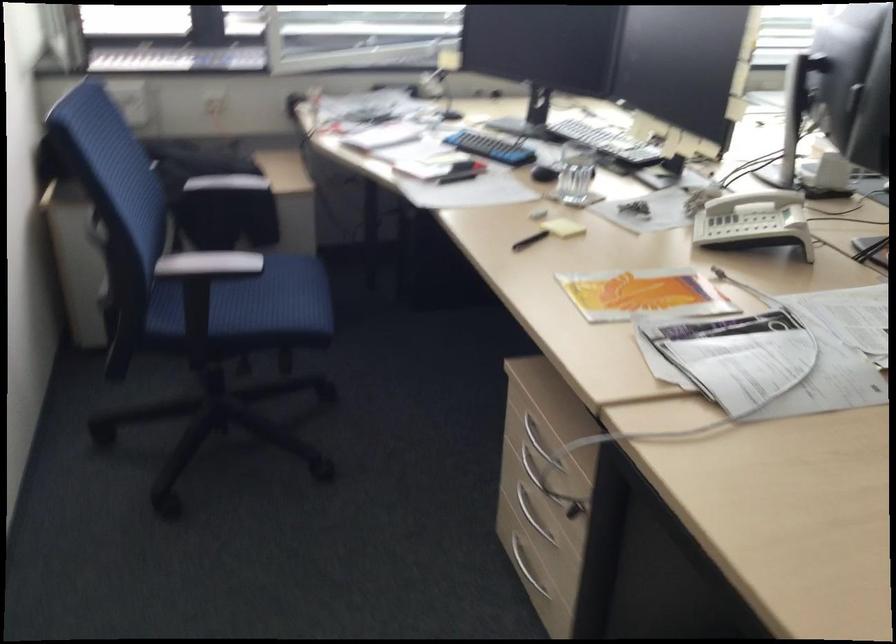
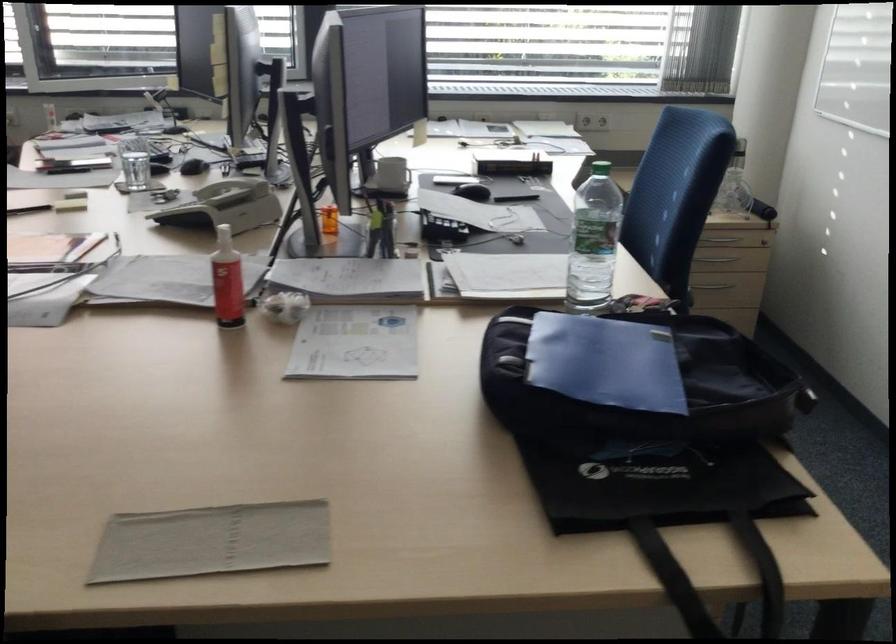
Question: In a continuous first-person perspective shot, in which direction is the camera moving?

Choices:
 (A) Left
 (B) Right
 (C) Forward
 (D) Backward

Answer: (B)